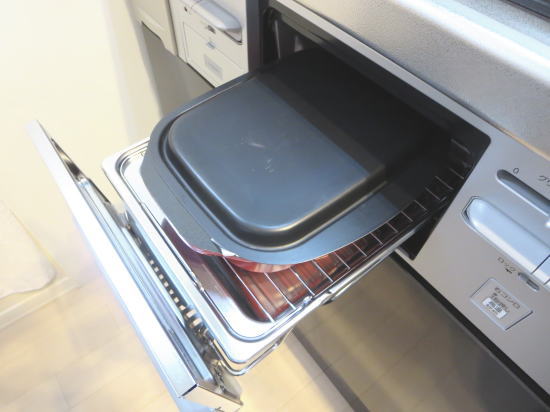
Find the location of a particular element. Image resolution: width=550 pixels, height=412 pixels. oven rack is located at coordinates (280, 321).